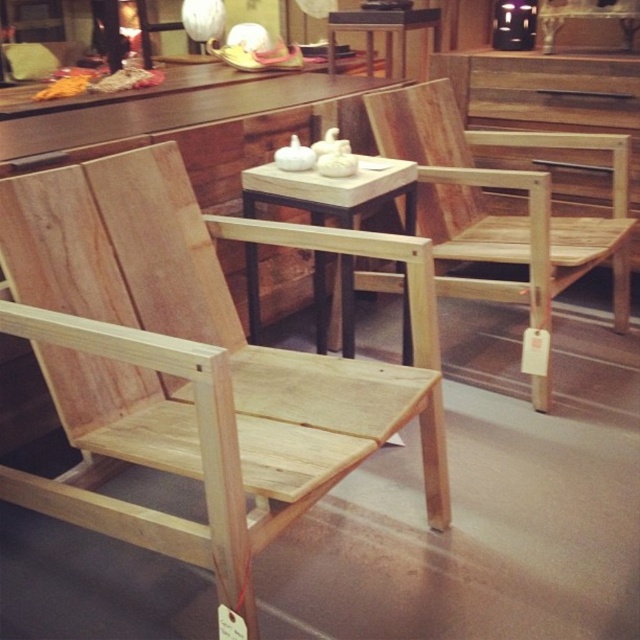
Question: Where is natural wood chair at left located in relation to matte black lampshade at upper center in the image?

Choices:
 (A) left
 (B) right

Answer: (A)

Question: Is light wood table at center smaller than matte white lampshade at upper center?

Choices:
 (A) yes
 (B) no

Answer: (B)

Question: Based on their relative distances, which object is farther from the light wood table at center?

Choices:
 (A) matte white lampshade at upper center
 (B) natural wood chair at center
 (C) matte black lampshade at upper center
 (D) natural wood chair at left

Answer: (A)

Question: Which point is closer to the camera taking this photo?

Choices:
 (A) (529, 8)
 (B) (326, 476)
 (C) (429, 20)

Answer: (B)

Question: Does natural wood chair at center have a lesser width compared to matte black lampshade at upper center?

Choices:
 (A) yes
 (B) no

Answer: (B)

Question: Which point appears closest to the camera in this image?

Choices:
 (A) (532, 28)
 (B) (116, 196)
 (C) (550, 275)

Answer: (B)